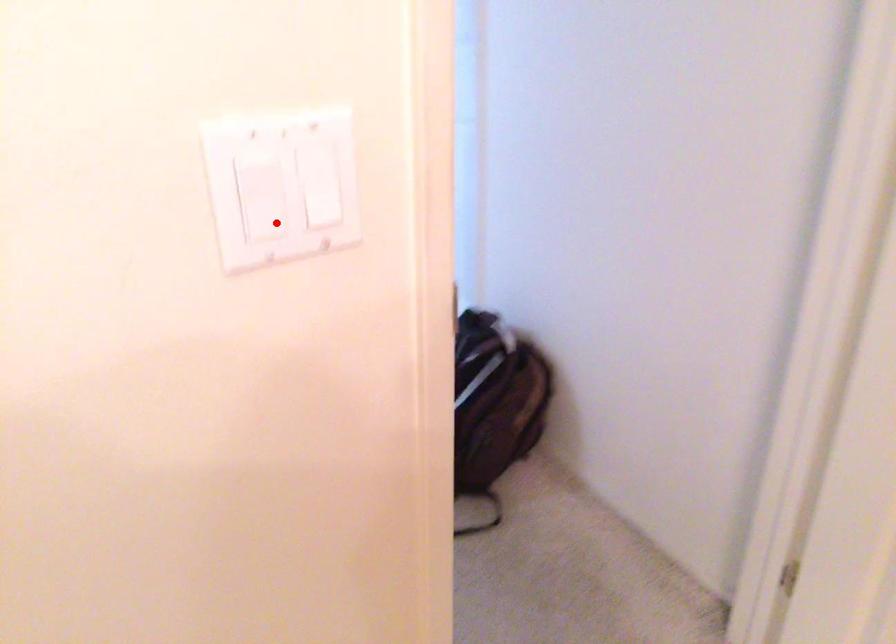
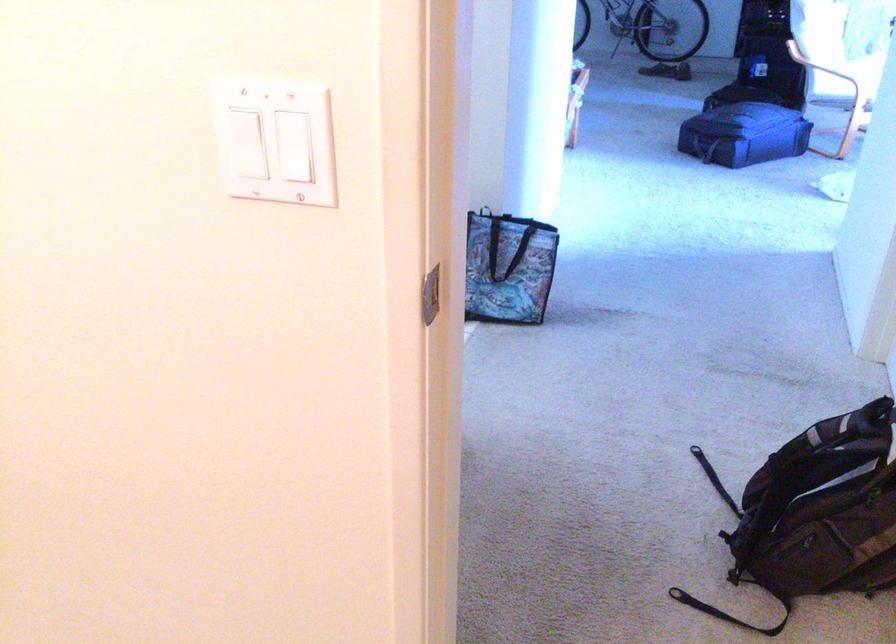
Locate, in the second image, the point that corresponds to the highlighted location in the first image.

(242, 143)